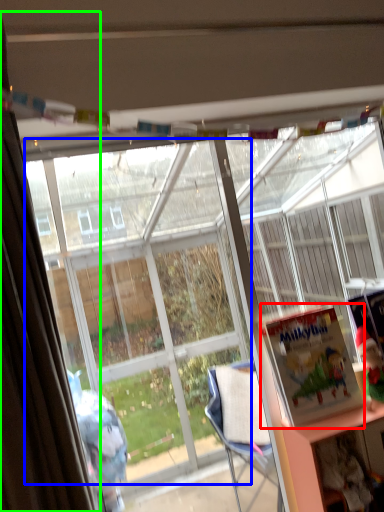
Question: Which object is positioned closest to book (highlighted by a red box)? Select from bay window (highlighted by a blue box) and curtain (highlighted by a green box).

Choices:
 (A) bay window
 (B) curtain

Answer: (B)